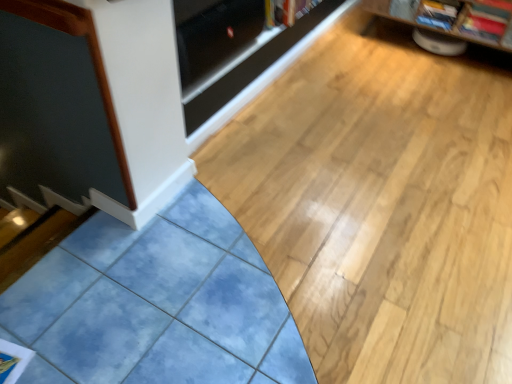
Question: Considering the positions of red glossy magazine at upper right, acting as the first magazine starting from the right, and hardcover book at upper center in the image, is red glossy magazine at upper right, acting as the first magazine starting from the right, taller or shorter than hardcover book at upper center?

Choices:
 (A) tall
 (B) short

Answer: (B)

Question: In terms of size, does red glossy magazine at upper right, arranged as the 2th magazine when viewed from the left, appear bigger or smaller than hardcover book at upper center?

Choices:
 (A) big
 (B) small

Answer: (B)

Question: Estimate the real-world distances between objects in this image. Which object is farther from the matte plastic magazine at upper right, marked as the second magazine in a right-to-left arrangement?

Choices:
 (A) red glossy magazine at upper right, acting as the first magazine starting from the right
 (B) wooden bookshelf at upper right
 (C) hardcover book at upper center
 (D) transparent glass door at upper center

Answer: (D)

Question: Which object is the closest to the matte plastic magazine at upper right, marked as the second magazine in a right-to-left arrangement?

Choices:
 (A) wooden bookshelf at upper right
 (B) transparent glass door at upper center
 (C) hardcover book at upper center
 (D) red glossy magazine at upper right, acting as the first magazine starting from the right

Answer: (D)